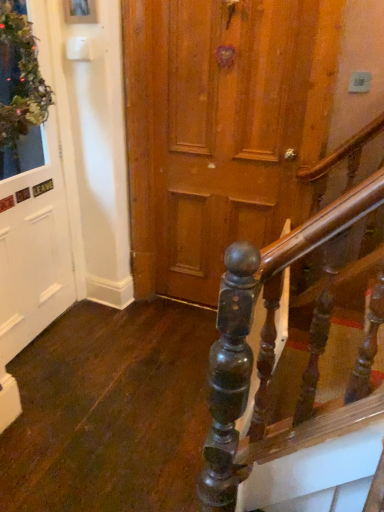
Question: Considering their positions, is green mossy wreath at upper left located in front of or behind white matte door at left?

Choices:
 (A) front
 (B) behind

Answer: (A)

Question: From the image's perspective, is green mossy wreath at upper left above or below white matte door at left?

Choices:
 (A) below
 (B) above

Answer: (B)

Question: Considering the positions of green mossy wreath at upper left and white matte door at left in the image, is green mossy wreath at upper left wider or thinner than white matte door at left?

Choices:
 (A) wide
 (B) thin

Answer: (A)

Question: Is white matte door at left inside or outside of green mossy wreath at upper left?

Choices:
 (A) outside
 (B) inside

Answer: (A)

Question: From the image's perspective, is white matte door at left located above or below green mossy wreath at upper left?

Choices:
 (A) above
 (B) below

Answer: (B)

Question: Would you say white matte door at left is to the left or to the right of green mossy wreath at upper left in the picture?

Choices:
 (A) left
 (B) right

Answer: (A)

Question: Considering the positions of white matte door at left and green mossy wreath at upper left in the image, is white matte door at left wider or thinner than green mossy wreath at upper left?

Choices:
 (A) thin
 (B) wide

Answer: (A)